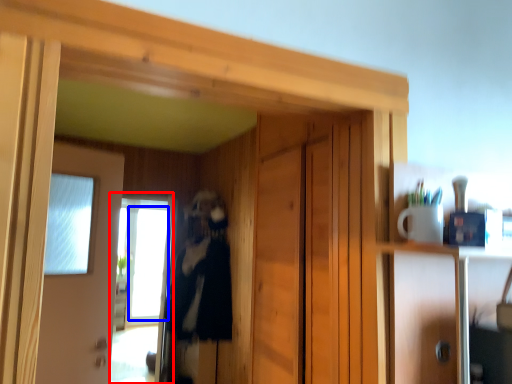
Question: Which object appears farthest to the camera in this image, screen door (highlighted by a red box) or window (highlighted by a blue box)?

Choices:
 (A) screen door
 (B) window

Answer: (B)